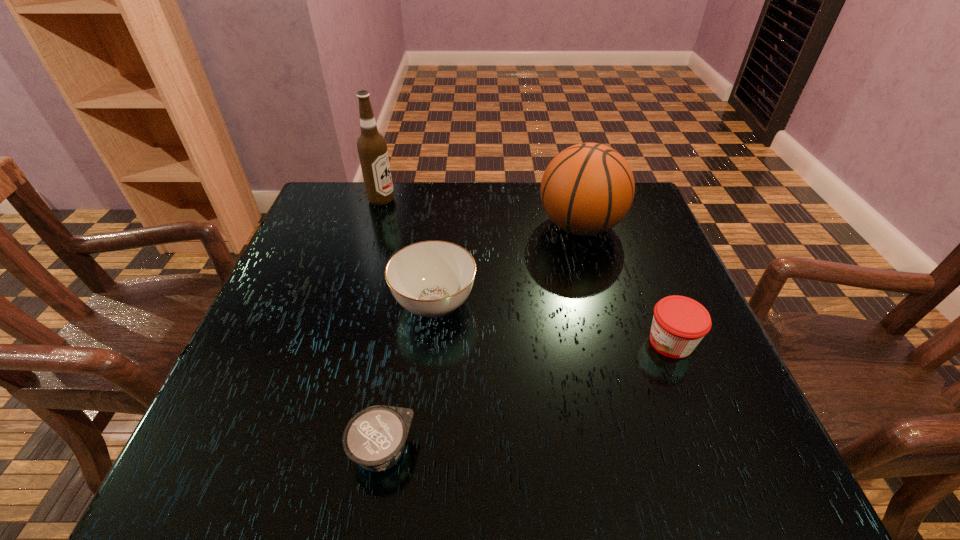
You are a GUI agent. You are given a task and a screenshot of the screen. Output one action in this format:
    pyautogui.click(x=<x>, y=<y>)
    Task: Click on the free spot between the tallest object and the fourth tallest object
    
    Given the screenshot: What is the action you would take?
    pyautogui.click(x=526, y=271)

This screenshot has width=960, height=540. What are the coordinates of `unoccupied position between the basketball and the chinaware` in the screenshot? It's located at (507, 265).

At what (x,y) coordinates should I click in order to perform the action: click on free space between the second shortest object and the fourth shortest object. Please return your answer as a coordinate pair (x, y). The image size is (960, 540). Looking at the image, I should click on (626, 284).

Where is `free space that is in between the yogurt and the second shortest object`? free space that is in between the yogurt and the second shortest object is located at coordinates (527, 396).

Where is `unoccupied area between the shortest object and the tallest object`? The width and height of the screenshot is (960, 540). unoccupied area between the shortest object and the tallest object is located at coordinates coord(382,326).

Where is `free space between the yogurt and the third tallest object`? free space between the yogurt and the third tallest object is located at coordinates (408, 377).

Identify the location of vacant space that is in between the jam and the basketball. (626, 284).

Where is `free space between the fourth tallest object and the basketball`? free space between the fourth tallest object and the basketball is located at coordinates (626, 284).

The height and width of the screenshot is (540, 960). What are the coordinates of `vacant area that lies between the leftmost object and the second tallest object` in the screenshot? It's located at (481, 213).

The width and height of the screenshot is (960, 540). I want to click on free spot between the nearest object and the third shortest object, so 408,377.